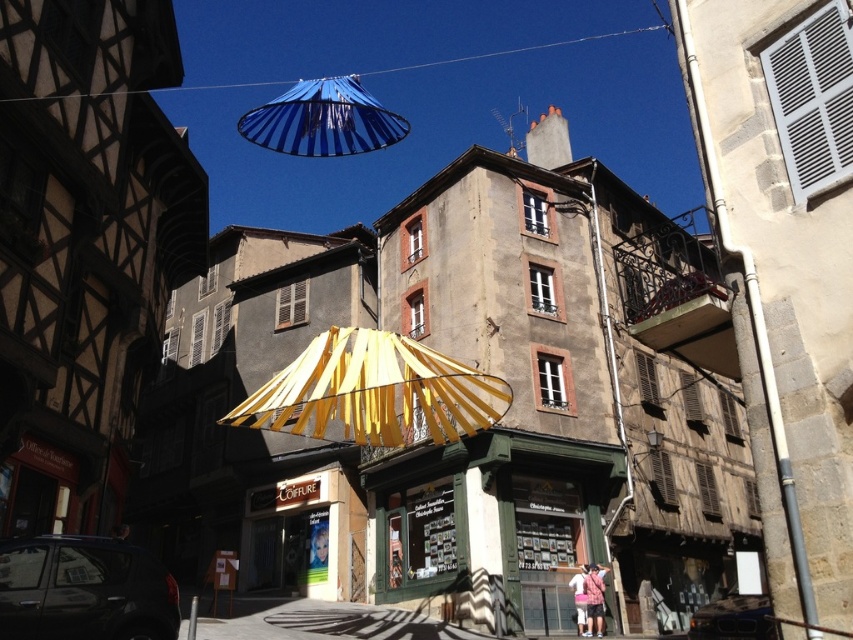
Question: Does yellow fabric umbrella at center have a lesser width compared to blue striped canopy at upper center?

Choices:
 (A) no
 (B) yes

Answer: (B)

Question: Observing the image, what is the correct spatial positioning of green wooden shop at center in reference to blue striped canopy at upper center?

Choices:
 (A) below
 (B) above

Answer: (A)

Question: Which point is closer to the camera taking this photo?

Choices:
 (A) (421, 548)
 (B) (300, 112)
 (C) (294, 362)

Answer: (C)

Question: Which point is farther from the camera taking this photo?

Choices:
 (A) (447, 419)
 (B) (397, 131)
 (C) (549, 620)

Answer: (B)

Question: Based on their relative distances, which object is farther from the blue striped canopy at upper center?

Choices:
 (A) yellow fabric umbrella at center
 (B) green wooden shop at center

Answer: (A)

Question: Is green wooden shop at center thinner than yellow fabric umbrella at center?

Choices:
 (A) no
 (B) yes

Answer: (B)